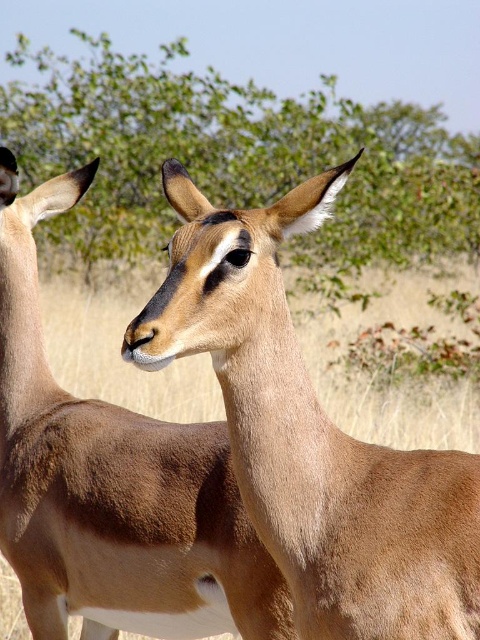
Does light brown fur at center have a greater height compared to green leafy tree at upper center?

In fact, light brown fur at center may be shorter than green leafy tree at upper center.

Between light brown fur at center and green leafy tree at upper center, which one appears on the left side from the viewer's perspective?

green leafy tree at upper center is more to the left.

Describe the element at coordinates (311, 435) in the screenshot. I see `light brown fur at center` at that location.

You are a GUI agent. You are given a task and a screenshot of the screen. Output one action in this format:
    pyautogui.click(x=<x>, y=<y>)
    Task: Click on the light brown fur at center
    The width and height of the screenshot is (480, 640).
    Given the screenshot: What is the action you would take?
    pyautogui.click(x=311, y=435)

Is the position of light brown fur at center more distant than that of brown matte antelope at center?

No, light brown fur at center is closer to the viewer.

Can you confirm if light brown fur at center is bigger than brown matte antelope at center?

No.

Find the location of `light brown fur at center`. light brown fur at center is located at coordinates (311, 435).

Who is positioned more to the left, green leafy tree at upper center or brown matte antelope at center?

Positioned to the left is brown matte antelope at center.

The image size is (480, 640). In order to click on green leafy tree at upper center in this screenshot , I will do `click(235, 156)`.

Is point (116, 161) less distant than point (110, 624)?

No.

Locate an element on the screen. green leafy tree at upper center is located at coordinates (235, 156).